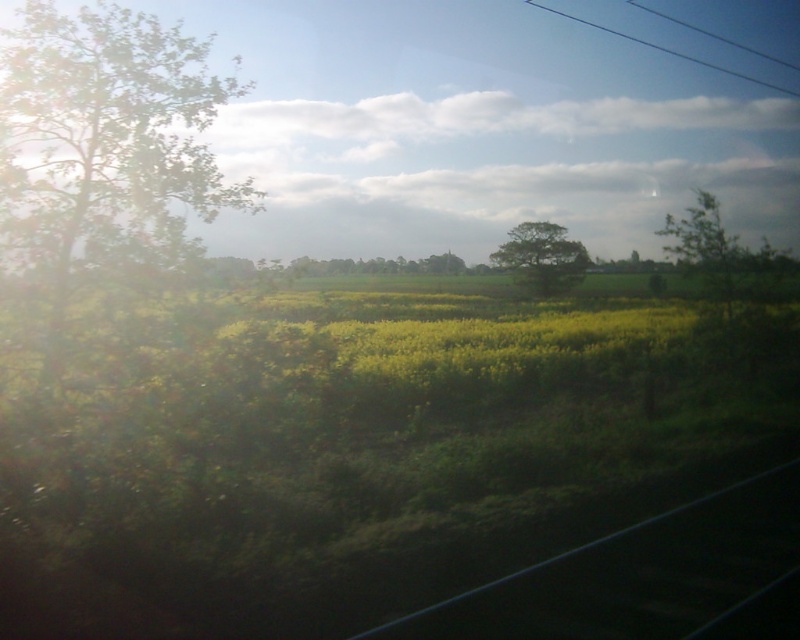
Which is above, green leafy tree at upper right or green leafy tree at center?

Positioned higher is green leafy tree at upper right.

Between green leafy tree at upper right and green leafy tree at center, which one appears on the right side from the viewer's perspective?

From the viewer's perspective, green leafy tree at upper right appears more on the right side.

Between point (690, 257) and point (513, 268), which one is positioned in front?

Point (690, 257) is in front.

In order to click on green leafy tree at upper right in this screenshot , I will do `click(717, 248)`.

Which is behind, point (14, 230) or point (532, 230)?

The point (532, 230) is more distant.

Does green leafy tree at left have a smaller size compared to green leafy tree at center?

No.

Does point (14, 189) come behind point (532, 273)?

No, it is in front of (532, 273).

The image size is (800, 640). What are the coordinates of `green leafy tree at left` in the screenshot? It's located at (104, 141).

Is green leafy tree at center below black wire at upper center?

Yes, green leafy tree at center is below black wire at upper center.

From the picture: Is green leafy tree at center bigger than black wire at upper center?

Actually, green leafy tree at center might be smaller than black wire at upper center.

Describe the element at coordinates (541, 257) in the screenshot. I see `green leafy tree at center` at that location.

The image size is (800, 640). I want to click on green leafy tree at center, so click(541, 257).